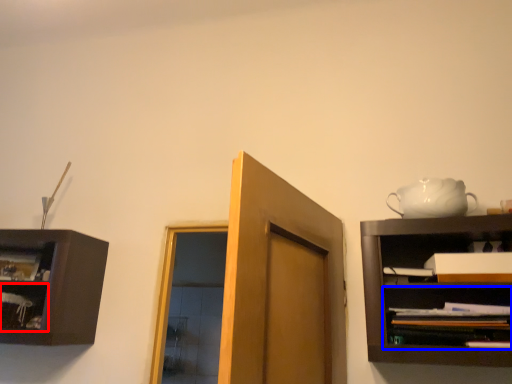
Question: Which point is closer to the camera, shelf (highlighted by a red box) or shelf (highlighted by a blue box)?

Choices:
 (A) shelf
 (B) shelf

Answer: (B)